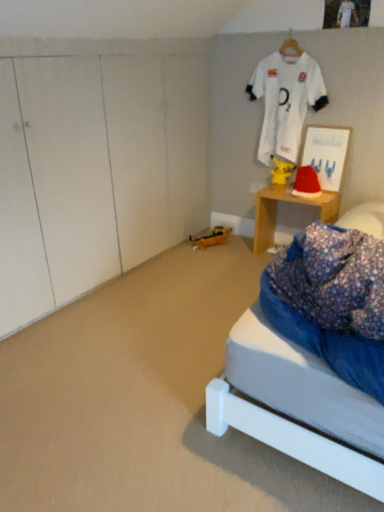
The image size is (384, 512). I want to click on blank space situated above white jersey at upper center (from a real-world perspective), so click(x=296, y=23).